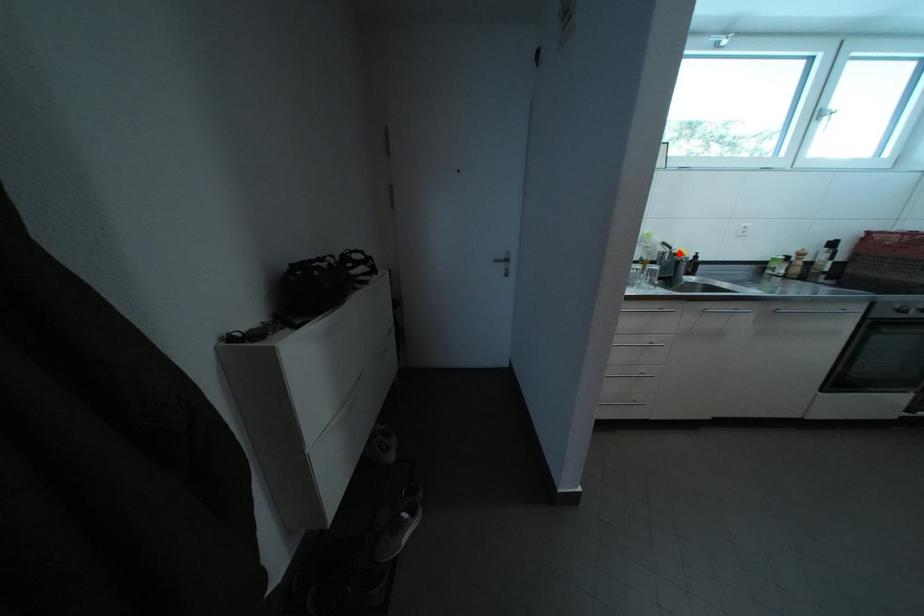
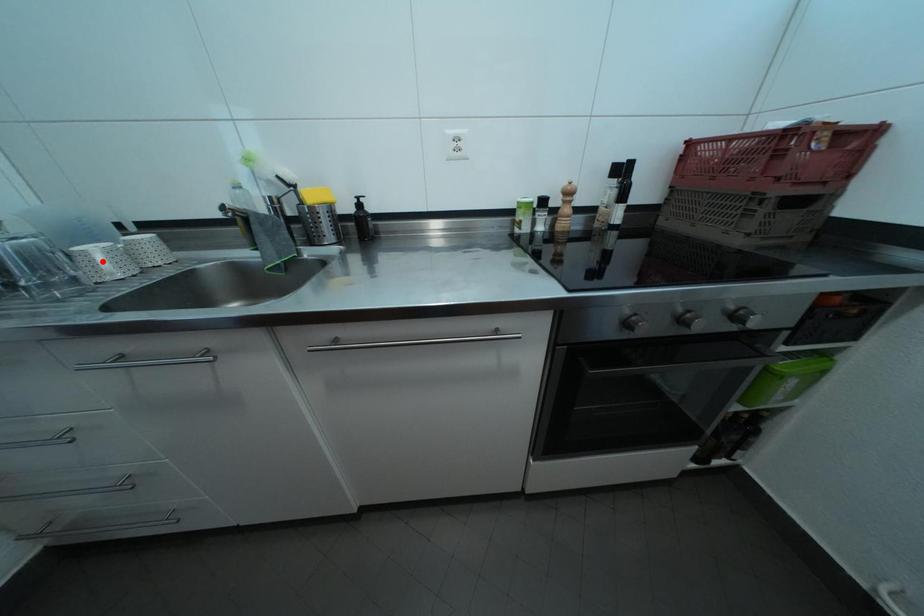
I am providing you with two images of the same scene from different viewpoints. A red point is marked on the first image and another point is marked on the second image. Does the point marked in image1 correspond to the same location as the one in image2?

No